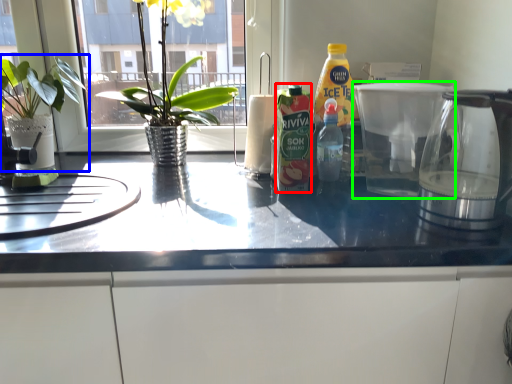
Question: Which object is positioned farthest from bottle (highlighted by a red box)? Select from houseplant (highlighted by a blue box) and coffeepot (highlighted by a green box).

Choices:
 (A) houseplant
 (B) coffeepot

Answer: (A)